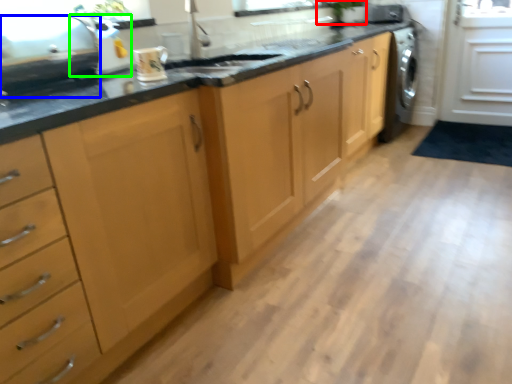
Question: Based on their relative distances, which object is nearer to plant (highlighted by a red box)? Choose from appliance (highlighted by a blue box) and appliance (highlighted by a green box).

Choices:
 (A) appliance
 (B) appliance

Answer: (B)